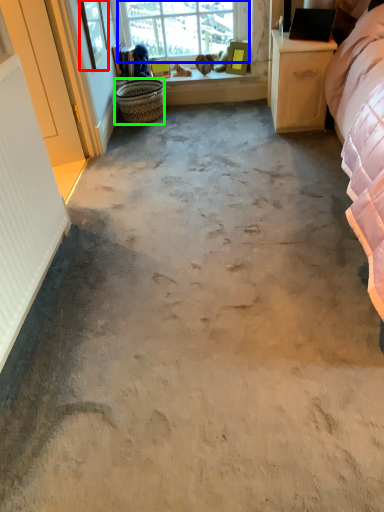
Question: Which is farther away from window screen (highlighted by a red box)? window (highlighted by a blue box) or basket (highlighted by a green box)?

Choices:
 (A) window
 (B) basket

Answer: (A)